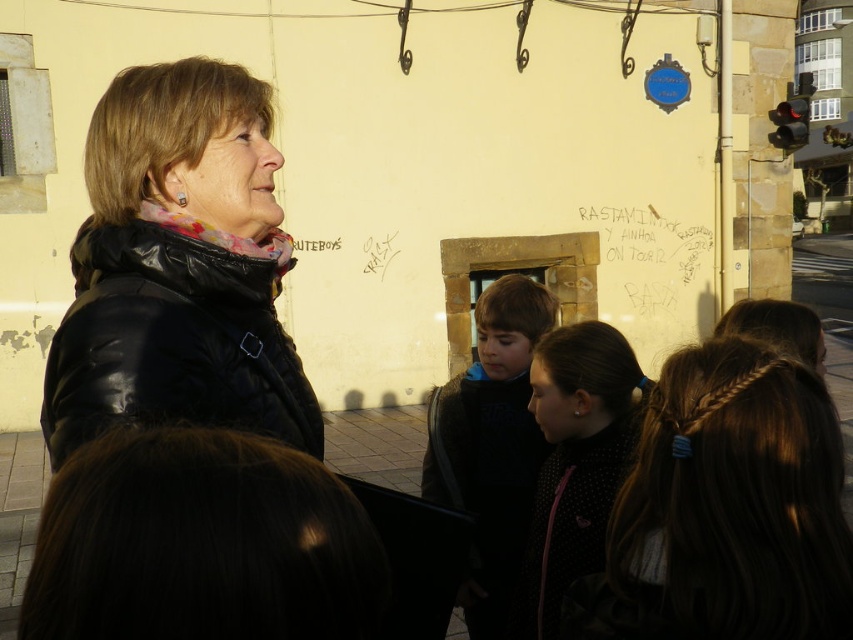
Does dark brown hair at lower left have a lesser height compared to dark blue sweater at center?

Correct, dark brown hair at lower left is not as tall as dark blue sweater at center.

Measure the distance between dark brown hair at lower left and dark blue sweater at center.

dark brown hair at lower left and dark blue sweater at center are 12.36 feet apart.

Who is more distant from viewer, (219,500) or (517,365)?

Positioned behind is point (517,365).

You are a GUI agent. You are given a task and a screenshot of the screen. Output one action in this format:
    pyautogui.click(x=<x>, y=<y>)
    Task: Click on the dark brown hair at lower left
    
    Given the screenshot: What is the action you would take?
    pyautogui.click(x=201, y=544)

Is dark brown hair at lower left positioned behind black dotted jacket at center?

No, it is in front of black dotted jacket at center.

What are the coordinates of `dark brown hair at lower left` in the screenshot? It's located at (201, 544).

Which is in front, point (135, 508) or point (631, 401)?

Positioned in front is point (135, 508).

The height and width of the screenshot is (640, 853). Find the location of `dark brown hair at lower left`. dark brown hair at lower left is located at coordinates (201, 544).

Does dark brown hair at lower left have a greater width compared to brown hair at center?

No, dark brown hair at lower left is not wider than brown hair at center.

Does dark brown hair at lower left come behind brown hair at center?

That is False.

The height and width of the screenshot is (640, 853). In order to click on dark brown hair at lower left in this screenshot , I will do `click(201, 544)`.

Image resolution: width=853 pixels, height=640 pixels. Identify the location of dark brown hair at lower left. (201, 544).